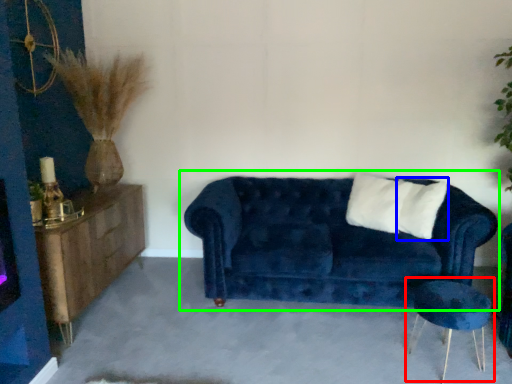
Question: Based on their relative distances, which object is nearer to side table (highlighted by a red box)? Choose from pillow (highlighted by a blue box) and studio couch (highlighted by a green box).

Choices:
 (A) pillow
 (B) studio couch

Answer: (B)